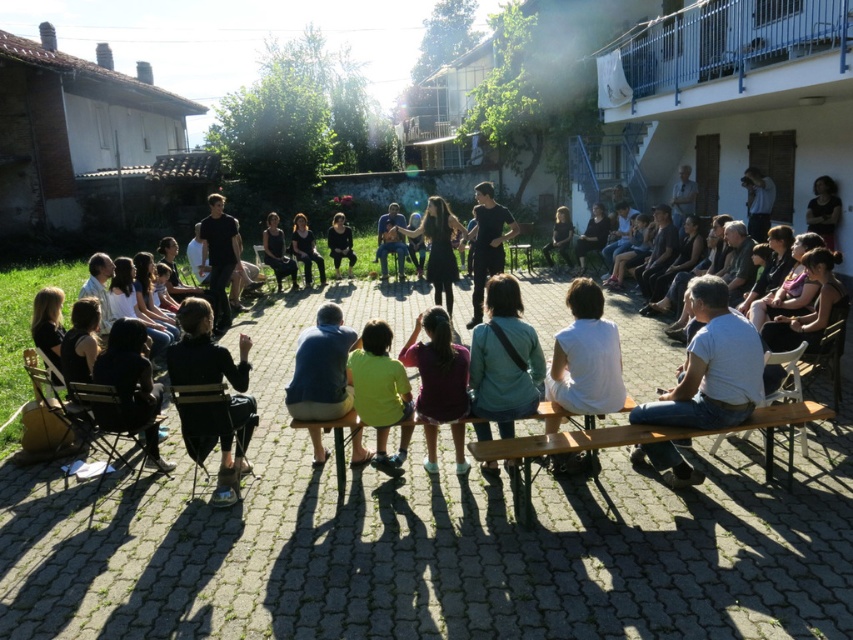
Between wooden park bench at center and green matte shirt at center, which one is positioned higher?

green matte shirt at center is higher up.

Does wooden park bench at center appear under green matte shirt at center?

Yes, wooden park bench at center is below green matte shirt at center.

This screenshot has height=640, width=853. Find the location of `wooden park bench at center`. wooden park bench at center is located at coordinates (564, 452).

The height and width of the screenshot is (640, 853). Identify the location of wooden park bench at center. (564, 452).

The image size is (853, 640). I want to click on matte purple shirt at center, so pos(439,381).

Can you confirm if matte purple shirt at center is shorter than green matte shirt at center?

No, matte purple shirt at center is not shorter than green matte shirt at center.

Find the location of a particular element. This screenshot has height=640, width=853. matte purple shirt at center is located at coordinates (439, 381).

Who is more forward, (762, 410) or (459, 410)?

Positioned in front is point (762, 410).

Between wooden park bench at center and matte purple shirt at center, which one has less height?

wooden park bench at center

Is point (624, 435) positioned in front of point (457, 380)?

Yes, it is.

This screenshot has width=853, height=640. What are the coordinates of `wooden park bench at center` in the screenshot? It's located at (564, 452).